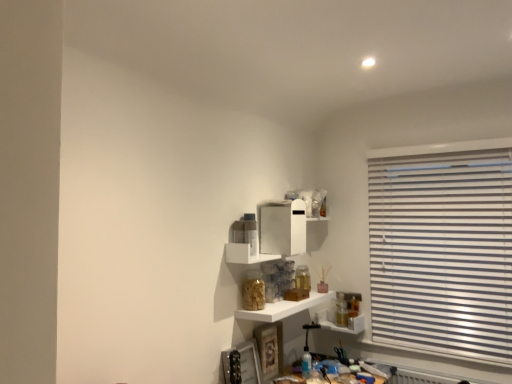
Question: Does translucent glass jar at lower right, which appears as the first shelf when ordered from the bottom, have a greater height compared to white glossy shelf at center, which ranks as the third shelf in bottom-to-top order?

Choices:
 (A) no
 (B) yes

Answer: (B)

Question: Can you confirm if translucent glass jar at lower right, which is the 3th shelf in top-to-bottom order, is bigger than white glossy shelf at center, which ranks as the third shelf in bottom-to-top order?

Choices:
 (A) no
 (B) yes

Answer: (A)

Question: Can you confirm if translucent glass jar at lower right, which appears as the first shelf when ordered from the bottom, is positioned to the left of white glossy shelf at center, which ranks as the third shelf in bottom-to-top order?

Choices:
 (A) yes
 (B) no

Answer: (B)

Question: From the image's perspective, is translucent glass jar at lower right, which is the 3th shelf in top-to-bottom order, above white glossy shelf at center, which ranks as the third shelf in bottom-to-top order?

Choices:
 (A) yes
 (B) no

Answer: (B)

Question: Is translucent glass jar at lower right, which appears as the first shelf when ordered from the bottom, completely or partially outside of white glossy shelf at center, which ranks as the third shelf in bottom-to-top order?

Choices:
 (A) yes
 (B) no

Answer: (A)

Question: Would you say white glossy shelf at center, the 1th shelf positioned from the top, is to the left or to the right of white glossy shelf at center, which is the second shelf from top to bottom, in the picture?

Choices:
 (A) right
 (B) left

Answer: (B)

Question: From their relative heights in the image, would you say white glossy shelf at center, which ranks as the third shelf in bottom-to-top order, is taller or shorter than white glossy shelf at center, which is the second shelf from top to bottom?

Choices:
 (A) tall
 (B) short

Answer: (A)

Question: From the image's perspective, is white glossy shelf at center, the 1th shelf positioned from the top, positioned above or below white glossy shelf at center, which is the second shelf from top to bottom?

Choices:
 (A) below
 (B) above

Answer: (B)

Question: Does point (247, 256) appear closer or farther from the camera than point (275, 304)?

Choices:
 (A) closer
 (B) farther

Answer: (A)

Question: In the image, is translucent glass jar at lower right, which appears as the first shelf when ordered from the bottom, on the left side or the right side of white glossy shelf at center, the 1th shelf positioned from the top?

Choices:
 (A) left
 (B) right

Answer: (B)

Question: Based on their sizes in the image, would you say translucent glass jar at lower right, which appears as the first shelf when ordered from the bottom, is bigger or smaller than white glossy shelf at center, which ranks as the third shelf in bottom-to-top order?

Choices:
 (A) small
 (B) big

Answer: (A)

Question: Does point (356, 324) appear closer or farther from the camera than point (280, 258)?

Choices:
 (A) closer
 (B) farther

Answer: (B)

Question: From a real-world perspective, is translucent glass jar at lower right, which is the 3th shelf in top-to-bottom order, positioned above or below white glossy shelf at center, the 1th shelf positioned from the top?

Choices:
 (A) below
 (B) above

Answer: (A)

Question: From the image's perspective, is white glossy shelf at center, which is the second shelf from top to bottom, located above or below white glossy shelf at center, the 1th shelf positioned from the top?

Choices:
 (A) above
 (B) below

Answer: (B)

Question: From a real-world perspective, relative to white glossy shelf at center, the 1th shelf positioned from the top, is white glossy shelf at center, the 2th shelf when ordered from bottom to top, vertically above or below?

Choices:
 (A) above
 (B) below

Answer: (B)